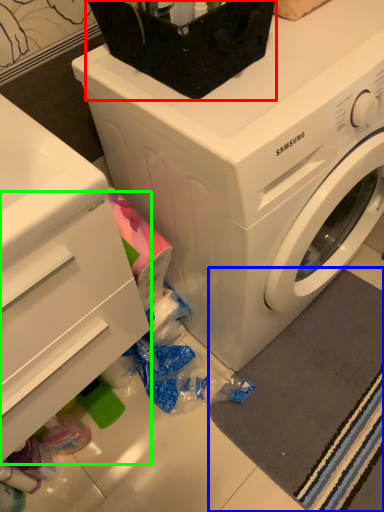
Question: Which is nearer to the appliance (highlighted by a red box)? bath mat (highlighted by a blue box) or drawer (highlighted by a green box).

Choices:
 (A) bath mat
 (B) drawer

Answer: (B)